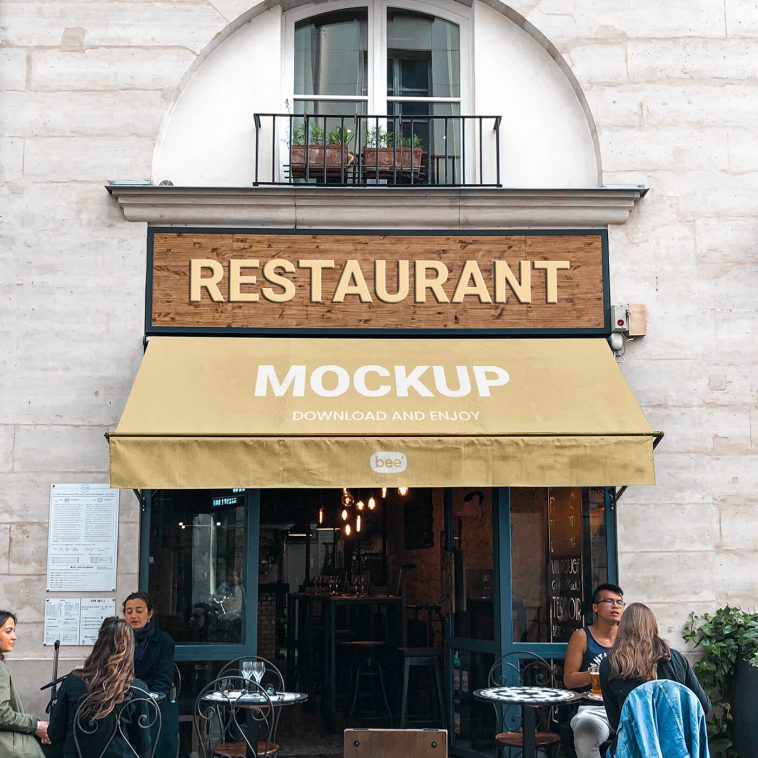
Identify the location of chairs. This screenshot has height=758, width=758. (155, 709), (237, 694), (280, 674), (634, 709), (525, 661).